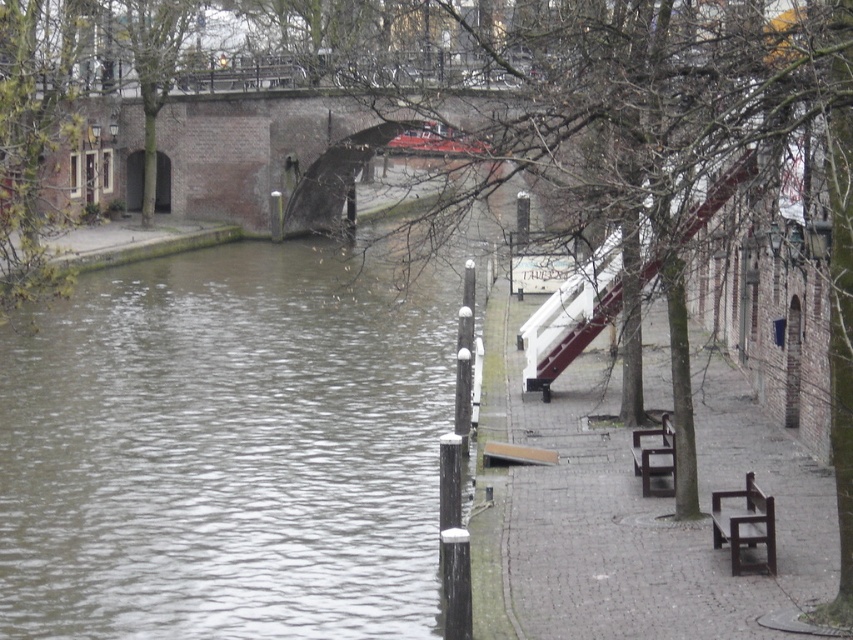
Is gray concrete river at center shorter than dark brown wooden bench at lower right?

No.

Measure the distance between point (328, 528) and camera.

Point (328, 528) is 20.84 meters away from camera.

Is point (366, 298) positioned behind point (763, 515)?

Yes, it is behind point (763, 515).

I want to click on gray concrete river at center, so 231,444.

Can you confirm if white painted wood rail at center right is positioned below dark brown wooden bench at lower right?

No.

The width and height of the screenshot is (853, 640). In order to click on white painted wood rail at center right in this screenshot , I will do `click(572, 317)`.

Between point (67, 532) and point (543, 378), which one is positioned behind?

Point (543, 378)

Between gray concrete river at center and white painted wood rail at center right, which one has more height?

gray concrete river at center

Measure the distance between point (492, 234) and camera.

Point (492, 234) and camera are 31.39 meters apart.

The height and width of the screenshot is (640, 853). I want to click on gray concrete river at center, so click(231, 444).